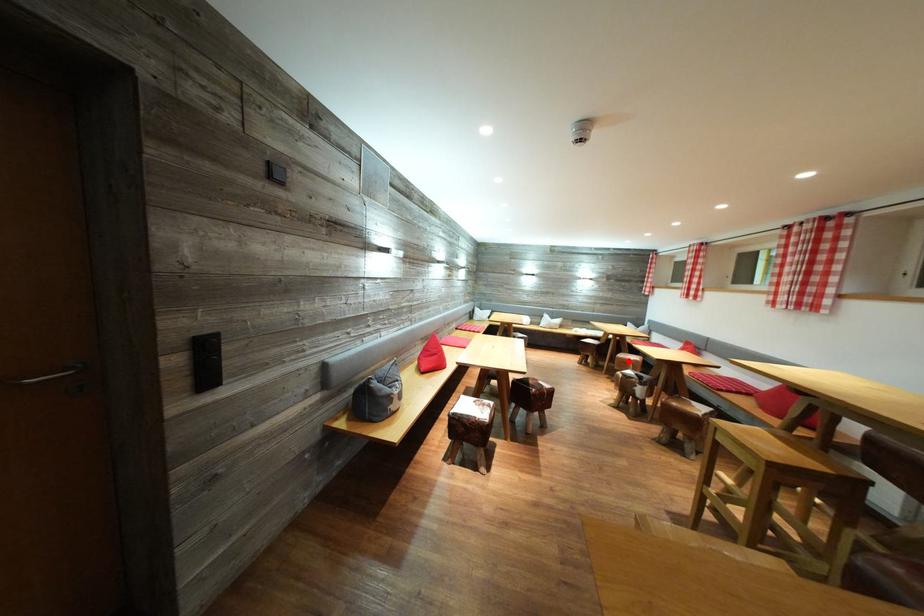
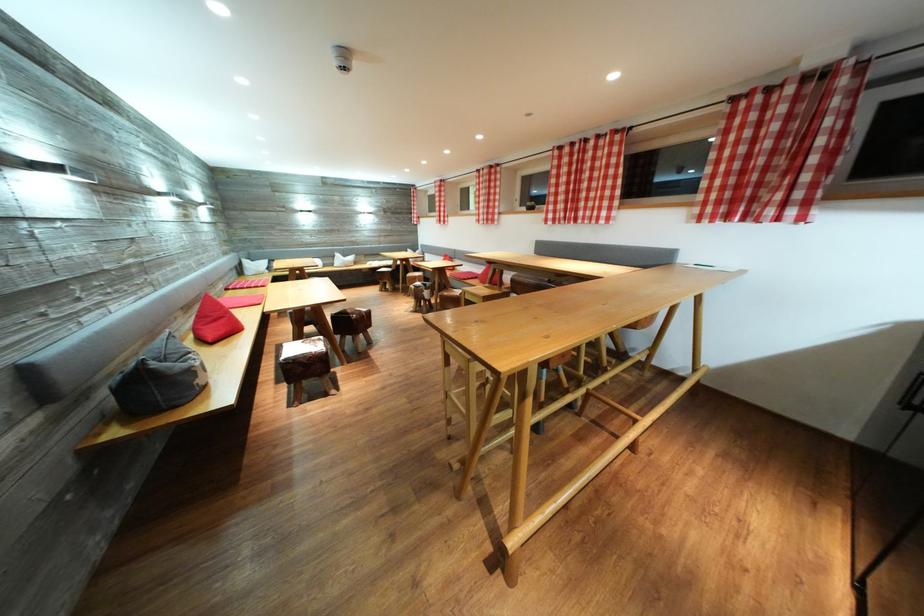
The point at the highlighted location is marked in the first image. Where is the corresponding point in the second image?

(417, 280)